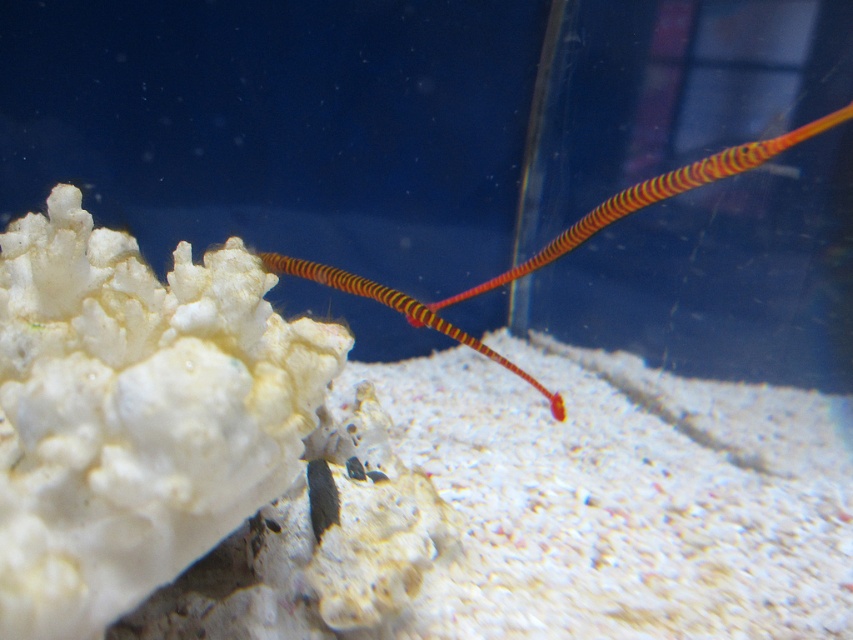
Question: Which of the following is the closest to the observer?

Choices:
 (A) (225, 506)
 (B) (695, 177)

Answer: (A)

Question: Is white porous coral at upper left smaller than orange striped pipefish at center?

Choices:
 (A) yes
 (B) no

Answer: (A)

Question: Does white porous coral at upper left have a greater width compared to orange striped pipefish at center?

Choices:
 (A) yes
 (B) no

Answer: (B)

Question: Can you confirm if white porous coral at upper left is wider than orange striped pipefish at center?

Choices:
 (A) no
 (B) yes

Answer: (A)

Question: Which point appears closest to the camera in this image?

Choices:
 (A) (67, 600)
 (B) (643, 182)

Answer: (A)